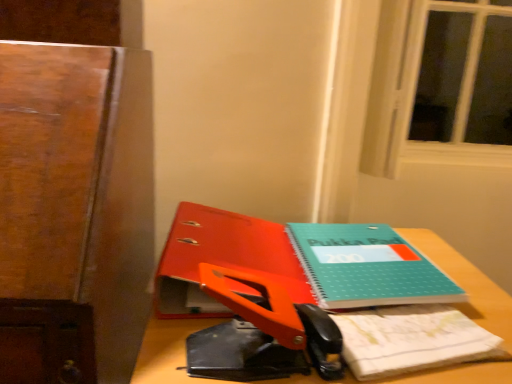
Question: From a real-world perspective, is teal matte notepad at center on teal matte notebook at center?

Choices:
 (A) yes
 (B) no

Answer: (B)

Question: Is there a large distance between teal matte notepad at center and teal matte notebook at center?

Choices:
 (A) yes
 (B) no

Answer: (B)

Question: Does teal matte notepad at center have a lesser height compared to teal matte notebook at center?

Choices:
 (A) no
 (B) yes

Answer: (B)

Question: Considering the relative sizes of teal matte notepad at center and teal matte notebook at center in the image provided, is teal matte notepad at center smaller than teal matte notebook at center?

Choices:
 (A) yes
 (B) no

Answer: (A)

Question: Does teal matte notepad at center have a lesser width compared to teal matte notebook at center?

Choices:
 (A) no
 (B) yes

Answer: (B)

Question: Is teal matte notepad at center looking in the opposite direction of teal matte notebook at center?

Choices:
 (A) yes
 (B) no

Answer: (B)

Question: Considering the relative sizes of wooden desk at center and teal matte notebook at center in the image provided, is wooden desk at center shorter than teal matte notebook at center?

Choices:
 (A) yes
 (B) no

Answer: (B)

Question: From a real-world perspective, is wooden desk at center located beneath teal matte notebook at center?

Choices:
 (A) no
 (B) yes

Answer: (B)

Question: Can you confirm if wooden desk at center is wider than teal matte notebook at center?

Choices:
 (A) no
 (B) yes

Answer: (B)

Question: Can we say wooden desk at center lies outside teal matte notebook at center?

Choices:
 (A) no
 (B) yes

Answer: (B)

Question: Considering the relative positions of wooden desk at center and teal matte notebook at center in the image provided, is wooden desk at center to the right of teal matte notebook at center from the viewer's perspective?

Choices:
 (A) no
 (B) yes

Answer: (B)

Question: From the image's perspective, is wooden desk at center over teal matte notebook at center?

Choices:
 (A) no
 (B) yes

Answer: (A)

Question: Is wooden desk at center surrounding teal matte notebook at center?

Choices:
 (A) yes
 (B) no

Answer: (A)